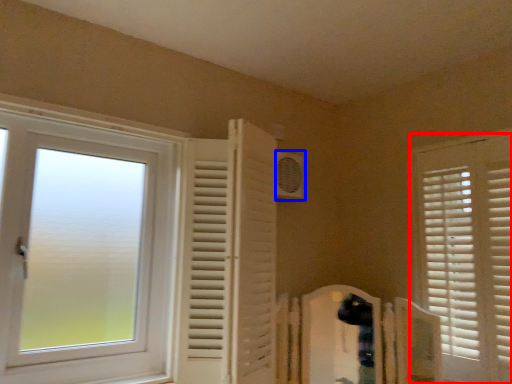
Question: Which object is further to the camera taking this photo, window (highlighted by a red box) or air conditioning (highlighted by a blue box)?

Choices:
 (A) window
 (B) air conditioning

Answer: (B)